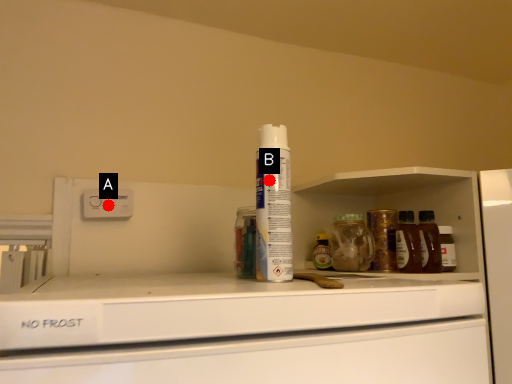
Question: Two points are circled on the image, labeled by A and B beside each circle. Which point appears farthest from the camera in this image?

Choices:
 (A) A is further
 (B) B is further

Answer: (A)